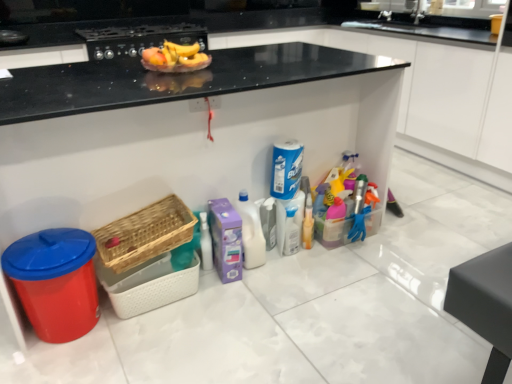
Describe the element at coordinates (139, 39) in the screenshot. The height and width of the screenshot is (384, 512). I see `matte black stove at upper center` at that location.

What do you see at coordinates (148, 285) in the screenshot? I see `woven wood basket at lower left, acting as the second basket starting from the top` at bounding box center [148, 285].

Where is `blue glossy spray can at center, placed as the first cleaning product when sorted from top to bottom`? blue glossy spray can at center, placed as the first cleaning product when sorted from top to bottom is located at coordinates (286, 169).

How far apart are white plastic bottle at center, which ranks as the first cleaning product in bottom-to-top order, and woven wood basket at lower left, acting as the second basket starting from the top?

They are 16.12 inches apart.

In terms of height, does white plastic bottle at center, the 1th cleaning product from the left, look taller or shorter compared to woven wood basket at lower left, placed as the first basket when sorted from bottom to top?

Clearly, white plastic bottle at center, the 1th cleaning product from the left, is taller compared to woven wood basket at lower left, placed as the first basket when sorted from bottom to top.

From the image's perspective, which one is positioned higher, white plastic bottle at center, the 1th cleaning product from the left, or woven wood basket at lower left, acting as the second basket starting from the top?

From the image's view, white plastic bottle at center, the 1th cleaning product from the left, is above.

From the picture: How many degrees apart are the facing directions of woven wood basket at lower left, which is counted as the second basket, starting from the bottom, and shiny plastic bowl at upper center?

1.5 degrees.

Is there a large distance between woven wood basket at lower left, arranged as the 1th basket when viewed from the top, and shiny plastic bowl at upper center?

No, woven wood basket at lower left, arranged as the 1th basket when viewed from the top, is not far away from shiny plastic bowl at upper center.

Visually, is woven wood basket at lower left, arranged as the 1th basket when viewed from the top, positioned to the left or to the right of shiny plastic bowl at upper center?

Clearly, woven wood basket at lower left, arranged as the 1th basket when viewed from the top, is on the left of shiny plastic bowl at upper center in the image.

Between woven wood basket at lower left, which is counted as the second basket, starting from the bottom, and shiny plastic bowl at upper center, which one has larger size?

woven wood basket at lower left, which is counted as the second basket, starting from the bottom, is bigger.

Based on the photo, is the position of blue glossy spray can at center, which appears as the second cleaning product when ordered from the bottom, more distant than that of woven wood basket at lower left, acting as the second basket starting from the top?

Yes, blue glossy spray can at center, which appears as the second cleaning product when ordered from the bottom, is further from the viewer.

Which of these two, blue glossy spray can at center, acting as the first cleaning product starting from the right, or woven wood basket at lower left, placed as the first basket when sorted from bottom to top, is smaller?

blue glossy spray can at center, acting as the first cleaning product starting from the right, is smaller.

How many degrees apart are the facing directions of blue glossy spray can at center, placed as the first cleaning product when sorted from top to bottom, and woven wood basket at lower left, placed as the first basket when sorted from bottom to top?

The facing directions of blue glossy spray can at center, placed as the first cleaning product when sorted from top to bottom, and woven wood basket at lower left, placed as the first basket when sorted from bottom to top, are 0.278 degrees apart.

From the picture: Considering the sizes of objects shiny plastic bowl at upper center and matte black stove at upper center in the image provided, who is shorter, shiny plastic bowl at upper center or matte black stove at upper center?

With less height is shiny plastic bowl at upper center.

Is shiny plastic bowl at upper center next to matte black stove at upper center?

shiny plastic bowl at upper center and matte black stove at upper center are clearly separated.

Looking at this image, from a real-world perspective, is shiny plastic bowl at upper center physically above matte black stove at upper center?

Yes.

Does point (187, 55) lie behind point (101, 59)?

No, (187, 55) is closer to viewer.

From a real-world perspective, between woven wood basket at lower left, arranged as the 1th basket when viewed from the top, and white plastic bottle at center, which ranks as the first cleaning product in bottom-to-top order, who is vertically higher?

woven wood basket at lower left, arranged as the 1th basket when viewed from the top.

Is the position of woven wood basket at lower left, arranged as the 1th basket when viewed from the top, less distant than that of white plastic bottle at center, which appears as the second cleaning product when viewed from the top?

Yes, woven wood basket at lower left, arranged as the 1th basket when viewed from the top, is closer to the viewer.

Is woven wood basket at lower left, which is counted as the second basket, starting from the bottom, beside white plastic bottle at center, the 1th cleaning product from the left?

woven wood basket at lower left, which is counted as the second basket, starting from the bottom, is not next to white plastic bottle at center, the 1th cleaning product from the left, and they're not touching.

Is blue glossy spray can at center, marked as the 2th cleaning product in a left-to-right arrangement, looking in the opposite direction of woven wood basket at lower left, which is counted as the second basket, starting from the bottom?

No, blue glossy spray can at center, marked as the 2th cleaning product in a left-to-right arrangement, is not facing the opposite direction of woven wood basket at lower left, which is counted as the second basket, starting from the bottom.

Considering the positions of objects blue glossy spray can at center, which appears as the second cleaning product when ordered from the bottom, and woven wood basket at lower left, arranged as the 1th basket when viewed from the top, in the image provided, who is more to the right, blue glossy spray can at center, which appears as the second cleaning product when ordered from the bottom, or woven wood basket at lower left, arranged as the 1th basket when viewed from the top,?

blue glossy spray can at center, which appears as the second cleaning product when ordered from the bottom.

Is blue glossy spray can at center, which appears as the second cleaning product when ordered from the bottom, taller than woven wood basket at lower left, which is counted as the second basket, starting from the bottom?

Yes.

From a real-world perspective, is white plastic bottle at center, which ranks as the first cleaning product in bottom-to-top order, physically located above or below shiny plastic bowl at upper center?

white plastic bottle at center, which ranks as the first cleaning product in bottom-to-top order, is below shiny plastic bowl at upper center.

Where is `the 1st cleaning product behind the shiny plastic bowl at upper center, counting from the anchor's position`? This screenshot has width=512, height=384. the 1st cleaning product behind the shiny plastic bowl at upper center, counting from the anchor's position is located at coordinates (251, 232).

Which is more to the left, white plastic bottle at center, which ranks as the first cleaning product in bottom-to-top order, or shiny plastic bowl at upper center?

Positioned to the left is shiny plastic bowl at upper center.

From the image's perspective, which basket is the 2nd one below the white plastic bottle at center, the 1th cleaning product from the left? Please provide its 2D coordinates.

[(148, 285)]

At what (x,y) coordinates should I click in order to perform the action: click on fruit on the right of the woven wood basket at lower left, which is counted as the second basket, starting from the bottom. Please return your answer as a coordinate pair (x, y). Looking at the image, I should click on (175, 56).

From the image, which object appears to be farther from white plastic bottle at center, which appears as the second cleaning product when viewed from the top, shiny plastic bowl at upper center or woven wood basket at lower left, acting as the second basket starting from the top?

shiny plastic bowl at upper center lies further to white plastic bottle at center, which appears as the second cleaning product when viewed from the top, than the other object.

From the image, which object appears to be farther from shiny plastic bowl at upper center, woven wood basket at lower left, arranged as the 1th basket when viewed from the top, or woven wood basket at lower left, placed as the first basket when sorted from bottom to top?

woven wood basket at lower left, placed as the first basket when sorted from bottom to top.

Based on their spatial positions, is matte black stove at upper center or woven wood basket at lower left, which is counted as the second basket, starting from the bottom, further from shiny plastic bowl at upper center?

matte black stove at upper center is further to shiny plastic bowl at upper center.

Based on their spatial positions, is matte black stove at upper center or blue glossy spray can at center, placed as the first cleaning product when sorted from top to bottom, closer to woven wood basket at lower left, acting as the second basket starting from the top?

The object closer to woven wood basket at lower left, acting as the second basket starting from the top, is blue glossy spray can at center, placed as the first cleaning product when sorted from top to bottom.

Which object lies nearer to the anchor point woven wood basket at lower left, which is counted as the second basket, starting from the bottom, woven wood basket at lower left, placed as the first basket when sorted from bottom to top, or shiny plastic bowl at upper center?

The object closer to woven wood basket at lower left, which is counted as the second basket, starting from the bottom, is woven wood basket at lower left, placed as the first basket when sorted from bottom to top.

Estimate the real-world distances between objects in this image. Which object is closer to blue glossy spray can at center, marked as the 2th cleaning product in a left-to-right arrangement, woven wood basket at lower left, acting as the second basket starting from the top, or shiny plastic bowl at upper center?

Based on the image, shiny plastic bowl at upper center appears to be nearer to blue glossy spray can at center, marked as the 2th cleaning product in a left-to-right arrangement.

When comparing their distances from white plastic bottle at center, the 2th cleaning product when ordered from right to left, does woven wood basket at lower left, placed as the first basket when sorted from bottom to top, or blue glossy spray can at center, marked as the 2th cleaning product in a left-to-right arrangement, seem closer?

Among the two, blue glossy spray can at center, marked as the 2th cleaning product in a left-to-right arrangement, is located nearer to white plastic bottle at center, the 2th cleaning product when ordered from right to left.

Estimate the real-world distances between objects in this image. Which object is closer to shiny plastic bowl at upper center, blue glossy spray can at center, marked as the 2th cleaning product in a left-to-right arrangement, or matte black stove at upper center?

Based on the image, blue glossy spray can at center, marked as the 2th cleaning product in a left-to-right arrangement, appears to be nearer to shiny plastic bowl at upper center.

The height and width of the screenshot is (384, 512). In order to click on basket between shiny plastic bowl at upper center and woven wood basket at lower left, acting as the second basket starting from the top, from top to bottom in this screenshot , I will do `click(145, 234)`.

At what (x,y) coordinates should I click in order to perform the action: click on cleaning product between woven wood basket at lower left, which is counted as the second basket, starting from the bottom, and blue glossy spray can at center, placed as the first cleaning product when sorted from top to bottom. Please return your answer as a coordinate pair (x, y). The width and height of the screenshot is (512, 384). Looking at the image, I should click on (251, 232).

You are a GUI agent. You are given a task and a screenshot of the screen. Output one action in this format:
    pyautogui.click(x=<x>, y=<y>)
    Task: Click on the basket between matte black stove at upper center and woven wood basket at lower left, acting as the second basket starting from the top, in the up-down direction
    This screenshot has height=384, width=512.
    Given the screenshot: What is the action you would take?
    pyautogui.click(x=145, y=234)

What are the coordinates of `cleaning product between matte black stove at upper center and white plastic bottle at center, which appears as the second cleaning product when viewed from the top, from top to bottom` in the screenshot? It's located at (286, 169).